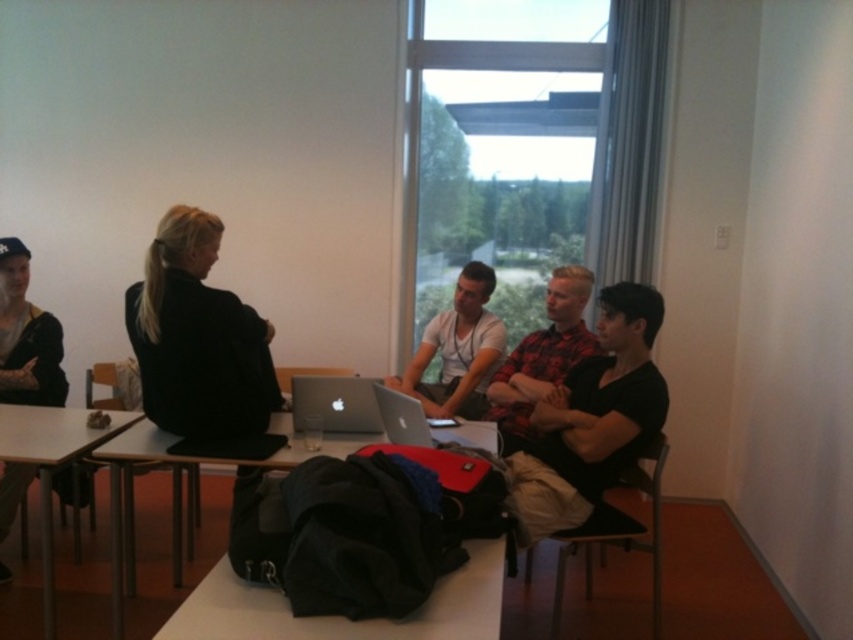
Question: Does black fabric bag at lower center appear over dark blue denim jacket at left?

Choices:
 (A) no
 (B) yes

Answer: (A)

Question: Which of the following is the farthest from the observer?

Choices:
 (A) satin silver laptop at center
 (B) dark blue denim jacket at left

Answer: (B)

Question: Which object is positioned farthest from the flannel shirt at center?

Choices:
 (A) dark blue denim jacket at left
 (B) black fabric bag at lower center

Answer: (A)

Question: Can you confirm if black cotton shirt at right is positioned to the right of silver metallic laptop at center?

Choices:
 (A) yes
 (B) no

Answer: (A)

Question: Which object appears farthest from the camera in this image?

Choices:
 (A) black cotton shirt at right
 (B) flannel shirt at center

Answer: (B)

Question: Is white plastic table at lower left to the right of silver metallic laptop at center from the viewer's perspective?

Choices:
 (A) yes
 (B) no

Answer: (B)